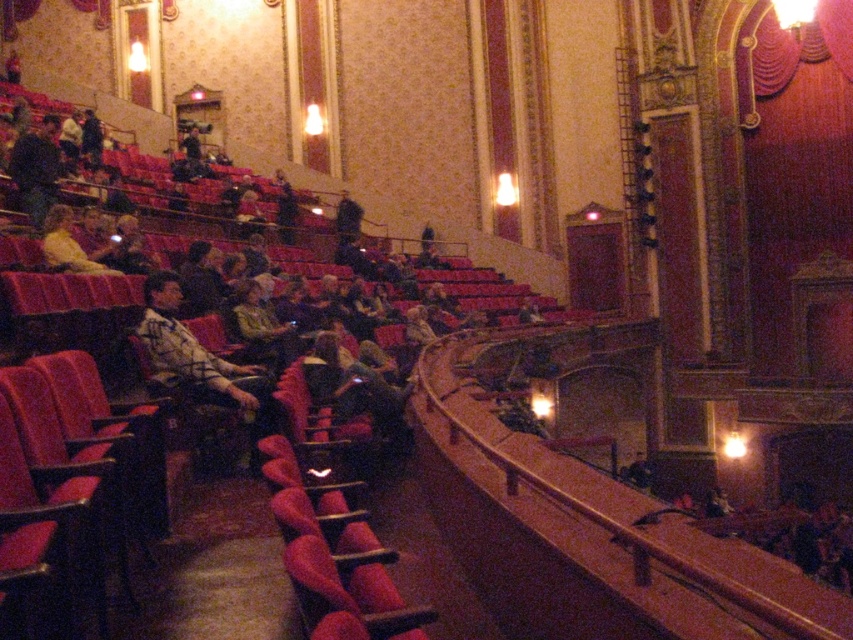
You are standing at the entrance of the theater and want to reach a specific point marked at coordinates point [151,362]. If your walking speed is 3 feet per second, how many seconds will it take you to reach that point?

The distance of point [151,362] from camera is 59.36 feet. At a speed of 3 feet per second, it will take approximately 19.79 seconds to reach the point.

You are sitting in the first row of the theater and notice two items at the center of the stage area. The plaid shirt at center and the leather jacket at center. Which item is closer to you?

The plaid shirt at center is closer to you than the leather jacket at center.